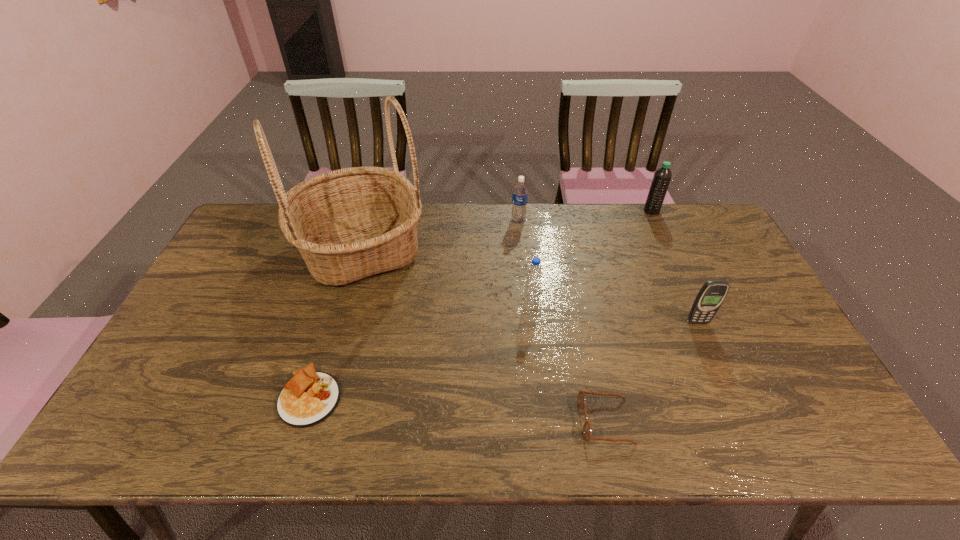
This screenshot has height=540, width=960. In the image, there is a desktop. Identify the location of vacant space at the far edge. (513, 230).

This screenshot has height=540, width=960. I want to click on vacant space at the near edge of the desktop, so click(624, 417).

Where is `free space at the left edge of the desktop`? The width and height of the screenshot is (960, 540). free space at the left edge of the desktop is located at coordinates (157, 375).

Find the location of a particular element. vacant region at the right edge of the desktop is located at coordinates (763, 336).

This screenshot has width=960, height=540. I want to click on free region at the far left corner, so click(x=254, y=211).

At what (x,y) coordinates should I click in order to perform the action: click on free region at the far right corner. Please return your answer as a coordinate pair (x, y). Looking at the image, I should click on (731, 244).

Locate an element on the screen. The height and width of the screenshot is (540, 960). vacant region at the near right corner of the desktop is located at coordinates (783, 427).

Locate an element on the screen. unoccupied area between the third nearest object and the farthest water bottle is located at coordinates (675, 266).

Find the location of a particular element. free space between the second farthest water bottle and the third nearest object is located at coordinates (608, 271).

Find the location of `vacant area between the cellular telephone and the rightmost water bottle`. vacant area between the cellular telephone and the rightmost water bottle is located at coordinates (675, 266).